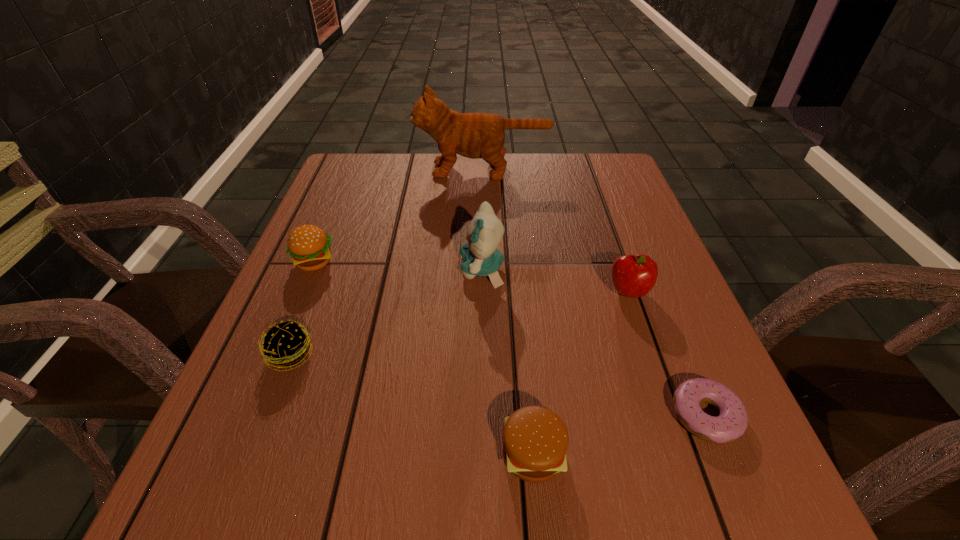
I want to click on vacant space in between the left hamburger and the cat, so click(x=398, y=216).

The image size is (960, 540). In order to click on vacant space in between the nearer hamburger and the third nearest object in this screenshot , I will do `click(412, 404)`.

Locate which object is the sixth closest to the taller hamburger. Please provide its 2D coordinates. Your answer should be formatted as a tuple, i.e. [(x, y)], where the tuple contains the x and y coordinates of a point satisfying the conditions above.

[(731, 423)]

Locate which object is the second closest to the apple. Please provide its 2D coordinates. Your answer should be formatted as a tuple, i.e. [(x, y)], where the tuple contains the x and y coordinates of a point satisfying the conditions above.

[(480, 256)]

This screenshot has height=540, width=960. Identify the location of free location that satisfies the following two spatial constraints: 1. on the face of the tallest object; 2. on the left side of the right hamburger. (485, 454).

Where is `free spot that satisfies the following two spatial constraints: 1. on the face of the right hamburger; 2. on the right side of the kitten`? The width and height of the screenshot is (960, 540). free spot that satisfies the following two spatial constraints: 1. on the face of the right hamburger; 2. on the right side of the kitten is located at coordinates (483, 454).

You are a GUI agent. You are given a task and a screenshot of the screen. Output one action in this format:
    pyautogui.click(x=<x>, y=<y>)
    Task: Click on the free space in the image that satisfies the following two spatial constraints: 1. on the face of the doughnut; 2. on the left side of the kitten
    The image size is (960, 540).
    Given the screenshot: What is the action you would take?
    pyautogui.click(x=483, y=415)

In order to click on free region that satisfies the following two spatial constraints: 1. on the face of the nearer hamburger; 2. on the right side of the tallest object in this screenshot , I will do `click(485, 454)`.

In order to click on free location that satisfies the following two spatial constraints: 1. on the face of the nearer hamburger; 2. on the left side of the cat in this screenshot , I will do `click(485, 454)`.

I want to click on blank area in the image that satisfies the following two spatial constraints: 1. on the face of the cat; 2. on the back side of the nearer hamburger, so click(x=485, y=454).